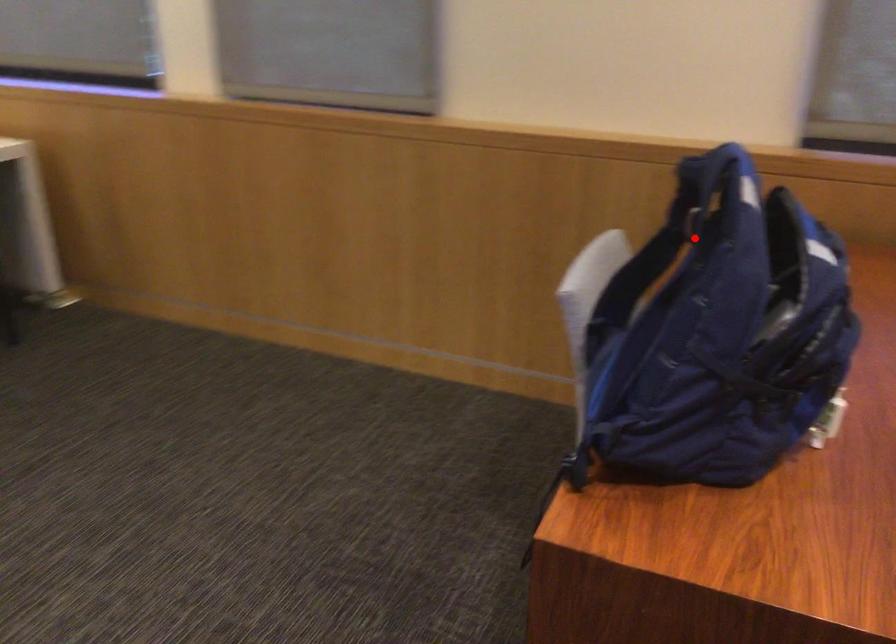
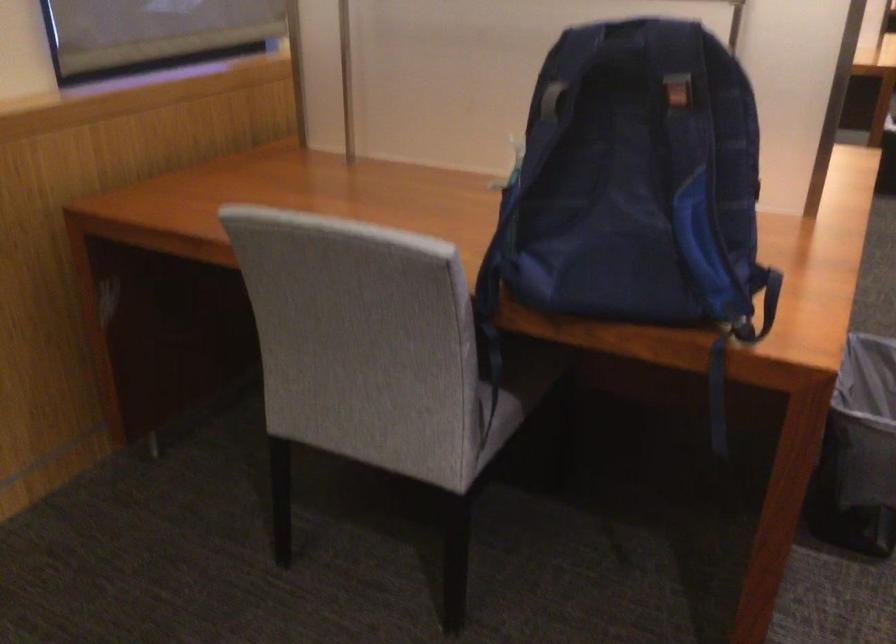
Question: I am providing you with two images of the same scene from different viewpoints. Image1 has a red point marked. In image2, the corresponding 3D location appears at what relative position? Reply with the corresponding letter.

Choices:
 (A) Closer
 (B) Farther

Answer: (B)